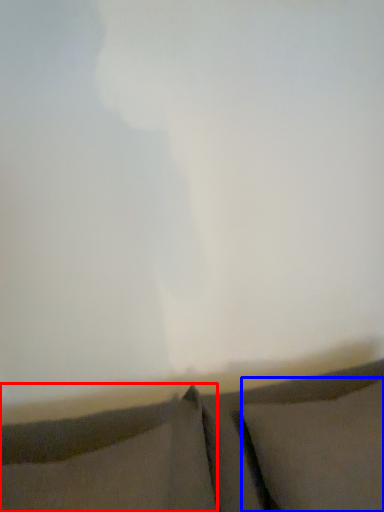
Question: Which object is further to the camera taking this photo, pillow (highlighted by a red box) or pillow (highlighted by a blue box)?

Choices:
 (A) pillow
 (B) pillow

Answer: (B)